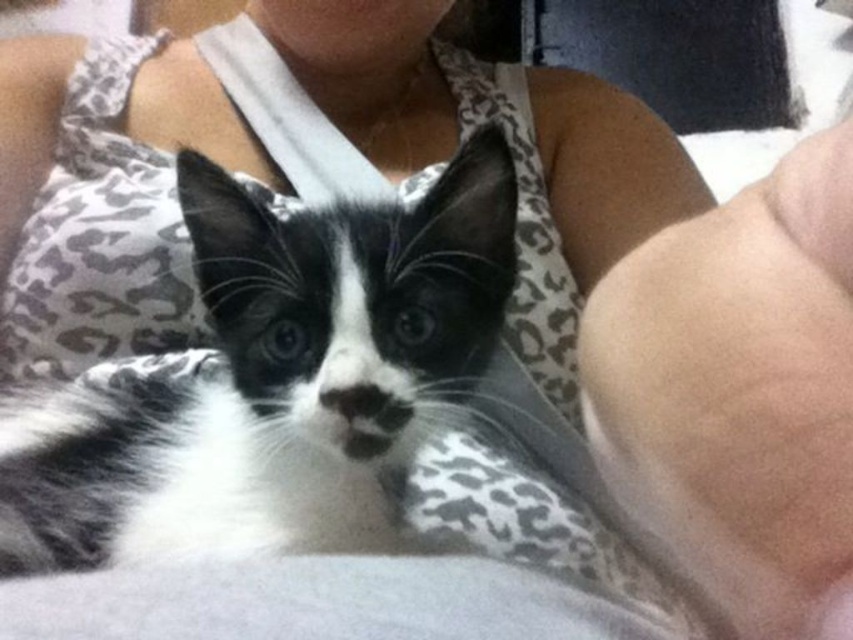
Consider the image. Is black and white fur cat at center in front of skinny white skin at lower right?

That is False.

Between black and white fur cat at center and skinny white skin at lower right, which one is positioned lower?

skinny white skin at lower right is lower down.

Who is more forward, [41,540] or [769,212]?

Point [769,212] is more forward.

You are a GUI agent. You are given a task and a screenshot of the screen. Output one action in this format:
    pyautogui.click(x=<x>, y=<y>)
    Task: Click on the black and white fur cat at center
    
    Given the screenshot: What is the action you would take?
    pyautogui.click(x=274, y=380)